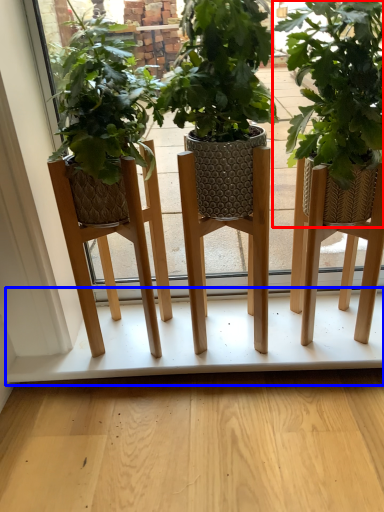
Question: Which object is further to the camera taking this photo, houseplant (highlighted by a red box) or shelf (highlighted by a blue box)?

Choices:
 (A) houseplant
 (B) shelf

Answer: (B)